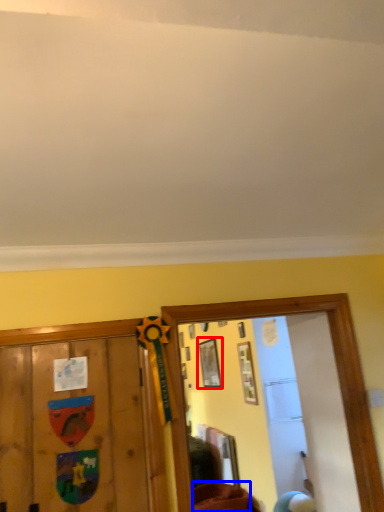
Question: Which point is further to the camera, picture frame (highlighted by a red box) or furniture (highlighted by a blue box)?

Choices:
 (A) picture frame
 (B) furniture

Answer: (A)